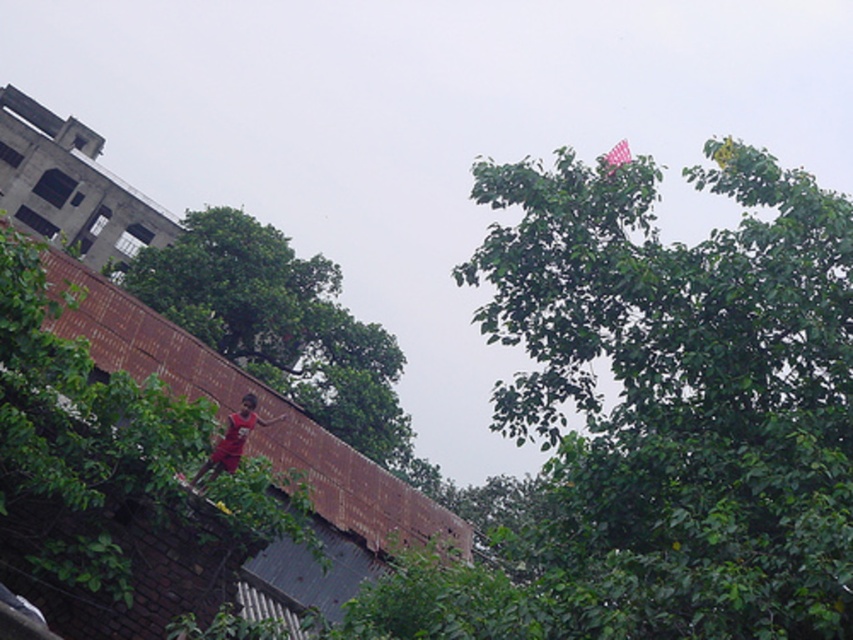
Question: Among these points, which one is nearest to the camera?

Choices:
 (A) (413, 490)
 (B) (618, 141)

Answer: (A)

Question: Is green leafy tree at upper right further to camera compared to brown brick wall at upper left?

Choices:
 (A) yes
 (B) no

Answer: (B)

Question: Does green leafy tree at upper right appear over brown brick wall at upper left?

Choices:
 (A) no
 (B) yes

Answer: (B)

Question: Which is farther from the red fabric person at center?

Choices:
 (A) green leafy tree at upper right
 (B) pink fabric kite at upper right

Answer: (B)

Question: Where is green leafy tree at center located in relation to red fabric person at center in the image?

Choices:
 (A) left
 (B) right

Answer: (A)

Question: Which object appears farthest from the camera in this image?

Choices:
 (A) green leafy tree at upper right
 (B) brown brick wall at upper left
 (C) green leafy tree at center
 (D) pink fabric kite at upper right

Answer: (C)